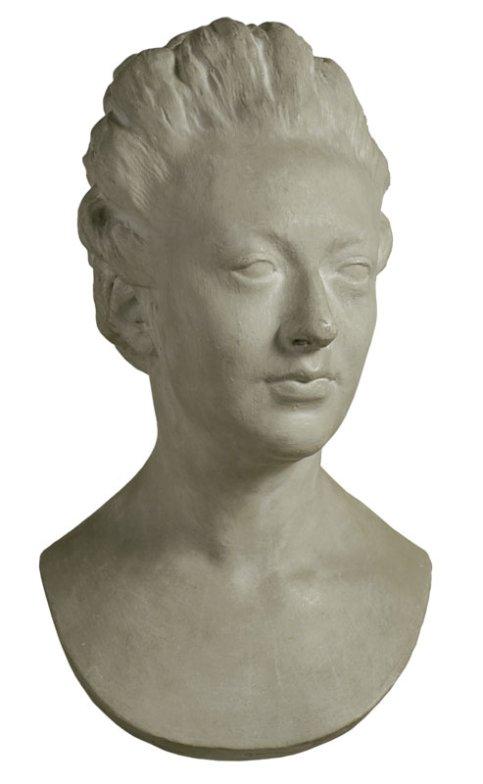
Identify the location of marble bust. (196, 325).